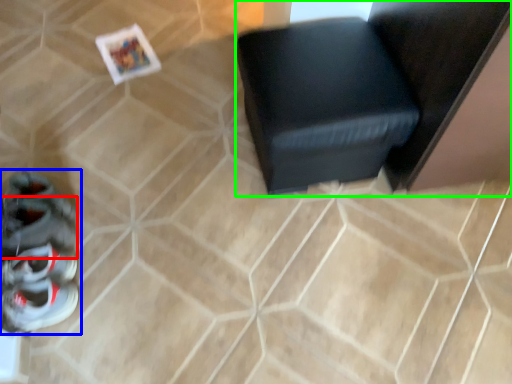
Question: Estimate the real-world distances between objects in this image. Which object is farther from shoe (highlighted by a red box), footwear (highlighted by a blue box) or furniture (highlighted by a green box)?

Choices:
 (A) footwear
 (B) furniture

Answer: (B)